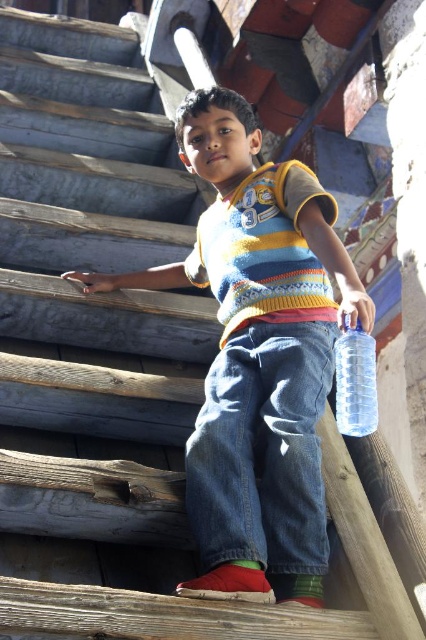
Who is more forward, (192, 504) or (370, 404)?

Point (192, 504) is more forward.

Does knitted sweater at center lie behind clear plastic bottle at right?

No.

Which is behind, point (310, 387) or point (347, 410)?

Positioned behind is point (310, 387).

The height and width of the screenshot is (640, 426). Find the location of `knitted sweater at center`. knitted sweater at center is located at coordinates (258, 355).